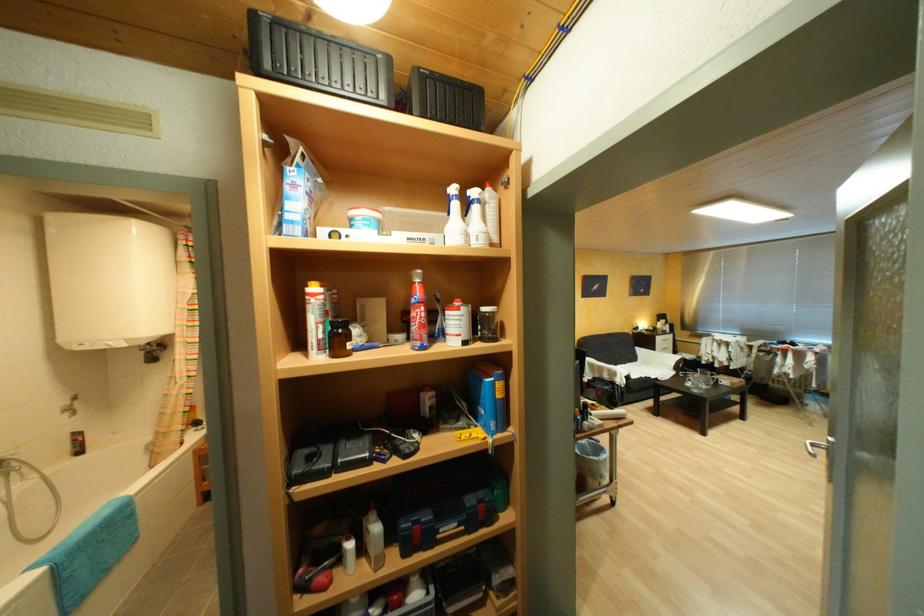
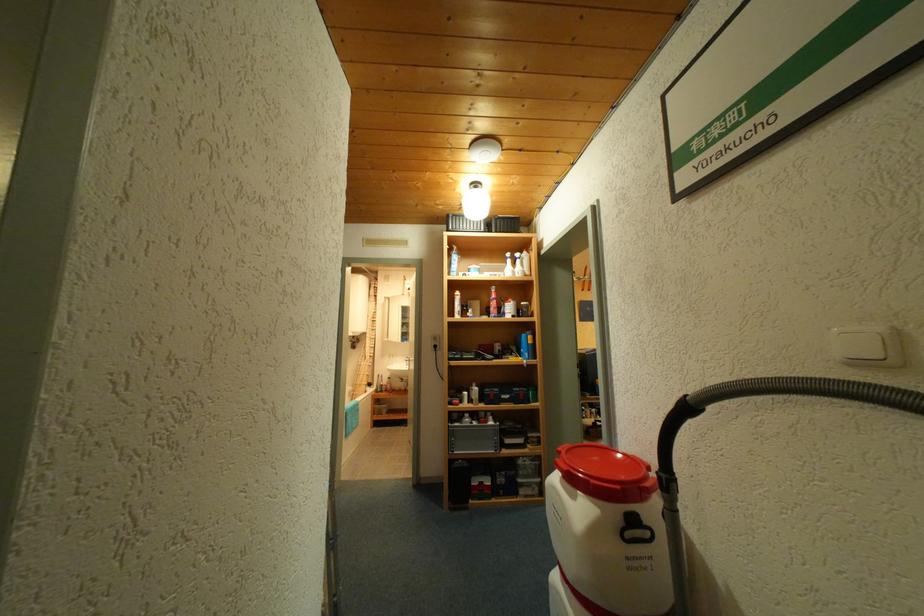
The point at (x=217, y=438) is marked in the first image. Where is the corresponding point in the second image?

(385, 392)